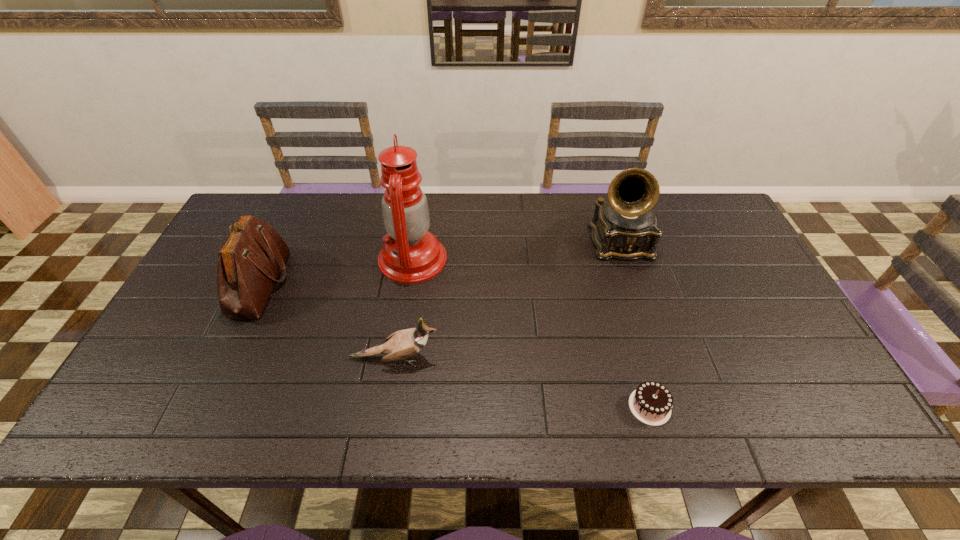
You are a GUI agent. You are given a task and a screenshot of the screen. Output one action in this format:
    pyautogui.click(x=<x>, y=<y>)
    Task: Click on the vacant region located 0.390m on the right of the third tallest object
    
    Given the screenshot: What is the action you would take?
    pyautogui.click(x=425, y=284)

You are a GUI agent. You are given a task and a screenshot of the screen. Output one action in this format:
    pyautogui.click(x=<x>, y=<y>)
    Task: Click on the vacant space located at the face of the second nearest object
    This screenshot has height=540, width=960.
    Given the screenshot: What is the action you would take?
    pyautogui.click(x=497, y=359)

In order to click on vacant space situated 0.350m on the left of the nearest object in this screenshot , I will do pos(471,407).

I want to click on oil lamp situated at the far edge, so click(x=410, y=254).

This screenshot has height=540, width=960. I want to click on phonograph record at the far edge, so click(x=625, y=227).

In order to click on object situated at the near edge in this screenshot , I will do `click(651, 403)`.

Where is `object at the left edge`? object at the left edge is located at coordinates (x=251, y=259).

The image size is (960, 540). In order to click on free space at the far edge in this screenshot , I will do `click(483, 215)`.

This screenshot has width=960, height=540. In the image, there is a desktop. What are the coordinates of `free space at the near edge` in the screenshot? It's located at (507, 420).

Where is `blank space at the right edge of the desktop`? The height and width of the screenshot is (540, 960). blank space at the right edge of the desktop is located at coordinates (753, 367).